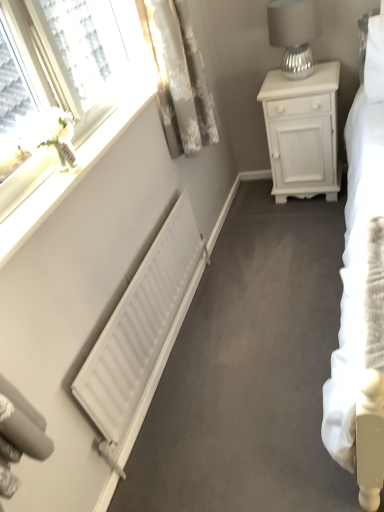
Question: Does silver textured lampshade at upper right come behind white textured curtain at upper left?

Choices:
 (A) no
 (B) yes

Answer: (B)

Question: Is silver textured lampshade at upper right shorter than white textured curtain at upper left?

Choices:
 (A) no
 (B) yes

Answer: (B)

Question: Is silver textured lampshade at upper right not inside white textured curtain at upper left?

Choices:
 (A) no
 (B) yes

Answer: (B)

Question: Is silver textured lampshade at upper right oriented away from white textured curtain at upper left?

Choices:
 (A) no
 (B) yes

Answer: (A)

Question: Can you confirm if silver textured lampshade at upper right is positioned to the right of white textured curtain at upper left?

Choices:
 (A) yes
 (B) no

Answer: (A)

Question: Is silver textured lampshade at upper right to the left of white textured curtain at upper left from the viewer's perspective?

Choices:
 (A) no
 (B) yes

Answer: (A)

Question: From the image's perspective, does white matte nightstand at upper right appear higher than white textured curtain at upper left?

Choices:
 (A) no
 (B) yes

Answer: (A)

Question: Can you confirm if white matte nightstand at upper right is shorter than white textured curtain at upper left?

Choices:
 (A) yes
 (B) no

Answer: (B)

Question: Is there a large distance between white matte nightstand at upper right and white textured curtain at upper left?

Choices:
 (A) no
 (B) yes

Answer: (A)

Question: Is white matte nightstand at upper right bigger than white textured curtain at upper left?

Choices:
 (A) yes
 (B) no

Answer: (A)

Question: Is white matte nightstand at upper right to the right of white textured curtain at upper left from the viewer's perspective?

Choices:
 (A) no
 (B) yes

Answer: (B)

Question: From a real-world perspective, is white matte nightstand at upper right on white textured curtain at upper left?

Choices:
 (A) yes
 (B) no

Answer: (B)

Question: Considering the relative sizes of white textured curtain at upper left and white matte radiator at lower left in the image provided, is white textured curtain at upper left wider than white matte radiator at lower left?

Choices:
 (A) no
 (B) yes

Answer: (B)